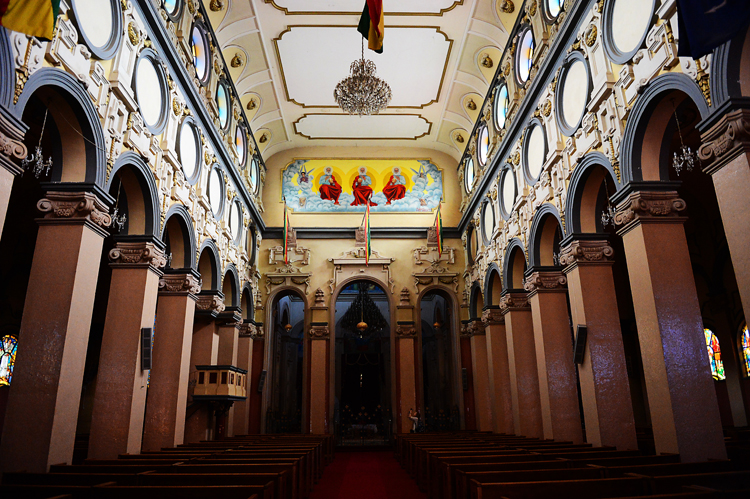
The height and width of the screenshot is (499, 750). Identify the location of painting. (361, 180), (580, 200).